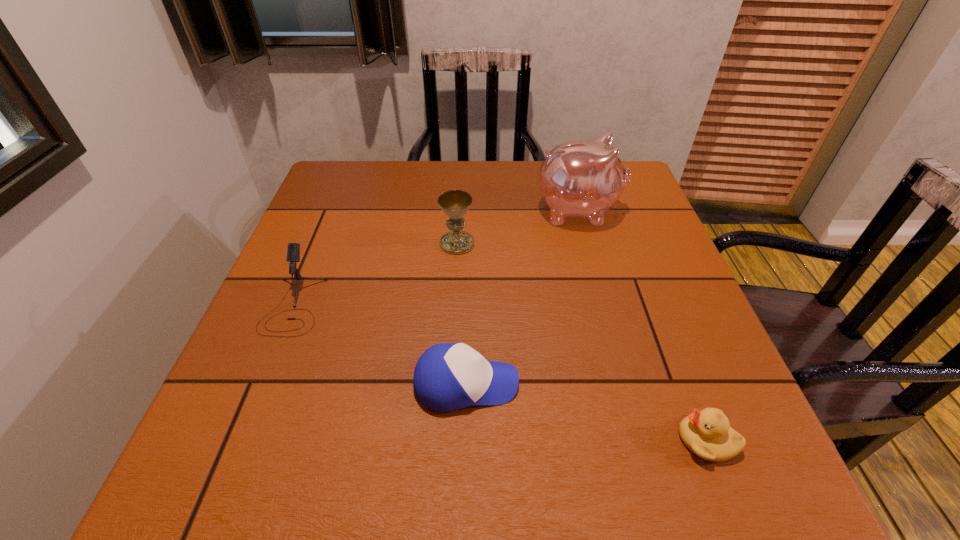
Locate an element on the screen. the tallest object is located at coordinates (582, 178).

You are a GUI agent. You are given a task and a screenshot of the screen. Output one action in this format:
    pyautogui.click(x=<x>, y=<y>)
    Task: Click on the chalice
    This screenshot has width=960, height=540.
    Given the screenshot: What is the action you would take?
    pyautogui.click(x=455, y=204)

At what (x,y) coordinates should I click in order to perform the action: click on the third farthest object. Please return your answer as a coordinate pair (x, y). The image size is (960, 540). Looking at the image, I should click on (293, 253).

At what (x,y) coordinates should I click in order to perform the action: click on the leftmost object. Please return your answer as a coordinate pair (x, y). The height and width of the screenshot is (540, 960). Looking at the image, I should click on (293, 253).

This screenshot has width=960, height=540. I want to click on baseball cap, so click(448, 376).

Locate an element on the screen. The image size is (960, 540). duckling is located at coordinates point(707,433).

This screenshot has height=540, width=960. I want to click on free space located 0.070m on the front facing side of the tallest object, so click(648, 211).

You are a GUI agent. You are given a task and a screenshot of the screen. Output one action in this format:
    pyautogui.click(x=<x>, y=<y>)
    Task: Click on the free space located 0.070m on the back of the chalice
    This screenshot has width=960, height=540.
    Given the screenshot: What is the action you would take?
    pyautogui.click(x=459, y=216)

I want to click on vacant region located on the stand of the third farthest object, so click(x=234, y=450).

Locate an element on the screen. vacant space situated on the front-facing side of the baseball cap is located at coordinates (645, 384).